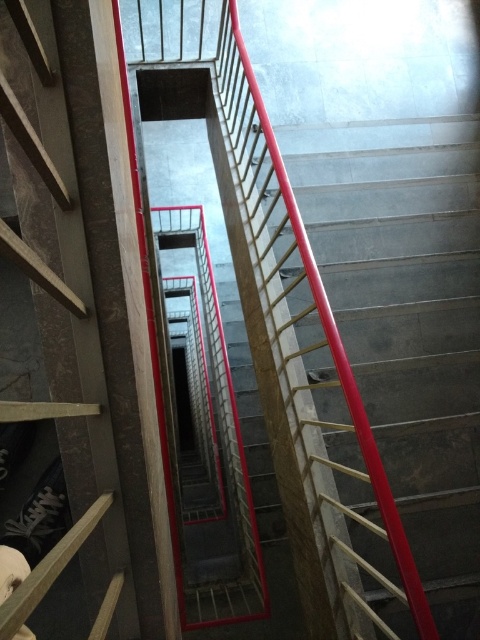
Question: Which of the following is the closest to the observer?

Choices:
 (A) (23, 92)
 (B) (242, 77)

Answer: (A)

Question: Is metallic silver ladder at center wider than metallic red handrail at center?

Choices:
 (A) yes
 (B) no

Answer: (B)

Question: Is metallic silver ladder at center bigger than metallic red handrail at center?

Choices:
 (A) yes
 (B) no

Answer: (B)

Question: Can you confirm if metallic silver ladder at center is positioned to the right of metallic red handrail at center?

Choices:
 (A) yes
 (B) no

Answer: (B)

Question: Among these points, which one is farthest from the camera?

Choices:
 (A) pos(264,288)
 (B) pos(124,536)

Answer: (A)

Question: Which point appears closest to the camera in this image?

Choices:
 (A) (34, 220)
 (B) (396, 538)

Answer: (B)